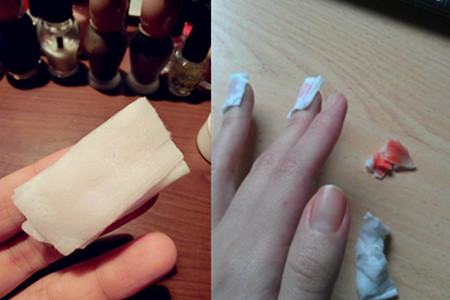
Identify the location of red-stained crumpled toilet paper. This screenshot has width=450, height=300. (391, 155).